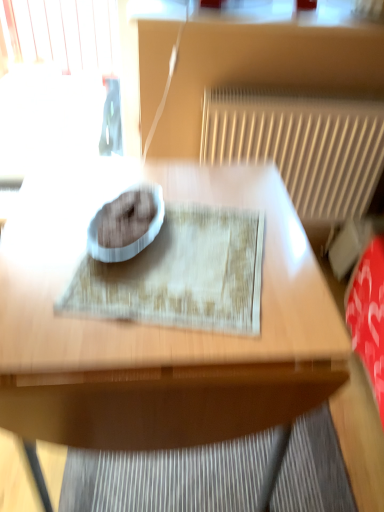
Question: Can you confirm if wooden table at center is shorter than textured beige mat at center?

Choices:
 (A) no
 (B) yes

Answer: (A)

Question: Does wooden table at center have a smaller size compared to textured beige mat at center?

Choices:
 (A) yes
 (B) no

Answer: (B)

Question: Is wooden table at center turned away from textured beige mat at center?

Choices:
 (A) no
 (B) yes

Answer: (A)

Question: Considering the relative sizes of wooden table at center and textured beige mat at center in the image provided, is wooden table at center taller than textured beige mat at center?

Choices:
 (A) yes
 (B) no

Answer: (A)

Question: Can you confirm if wooden table at center is bigger than textured beige mat at center?

Choices:
 (A) yes
 (B) no

Answer: (A)

Question: Is wooden table at center thinner than textured beige mat at center?

Choices:
 (A) no
 (B) yes

Answer: (A)

Question: From a real-world perspective, is textured beige mat at center on wooden table at center?

Choices:
 (A) yes
 (B) no

Answer: (A)

Question: Does textured beige mat at center have a lesser height compared to wooden table at center?

Choices:
 (A) yes
 (B) no

Answer: (A)

Question: Can you confirm if textured beige mat at center is positioned to the right of wooden table at center?

Choices:
 (A) yes
 (B) no

Answer: (A)

Question: Is the depth of textured beige mat at center less than that of wooden table at center?

Choices:
 (A) no
 (B) yes

Answer: (A)

Question: Is textured beige mat at center looking in the opposite direction of wooden table at center?

Choices:
 (A) yes
 (B) no

Answer: (A)

Question: Can you confirm if textured beige mat at center is bigger than wooden table at center?

Choices:
 (A) yes
 (B) no

Answer: (B)

Question: Does wooden table at center have a greater height compared to white textured radiator at upper right?

Choices:
 (A) yes
 (B) no

Answer: (A)